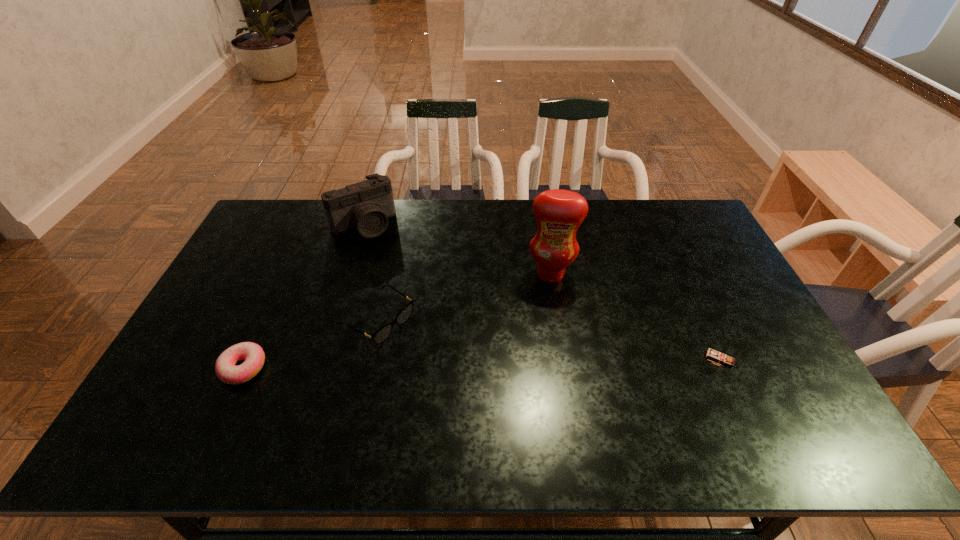
Identify the location of object that is at the far edge. (366, 206).

Where is `object present at the near edge`? Image resolution: width=960 pixels, height=540 pixels. object present at the near edge is located at coordinates (252, 353).

In order to click on object located in the left edge section of the desktop in this screenshot , I will do `click(252, 353)`.

Where is `object at the right edge`? Image resolution: width=960 pixels, height=540 pixels. object at the right edge is located at coordinates (721, 355).

Find the location of `object at the near left corner`. object at the near left corner is located at coordinates (252, 353).

In the image, there is a desktop. Find the location of `vacant space at the far edge`. vacant space at the far edge is located at coordinates (318, 204).

Locate an element on the screen. free region at the near edge is located at coordinates (388, 397).

Locate an element on the screen. Image resolution: width=960 pixels, height=540 pixels. vacant area at the left edge is located at coordinates (207, 334).

Find the location of a particular element. vacant space at the right edge is located at coordinates (712, 240).

The width and height of the screenshot is (960, 540). I want to click on free location at the near left corner of the desktop, so click(203, 396).